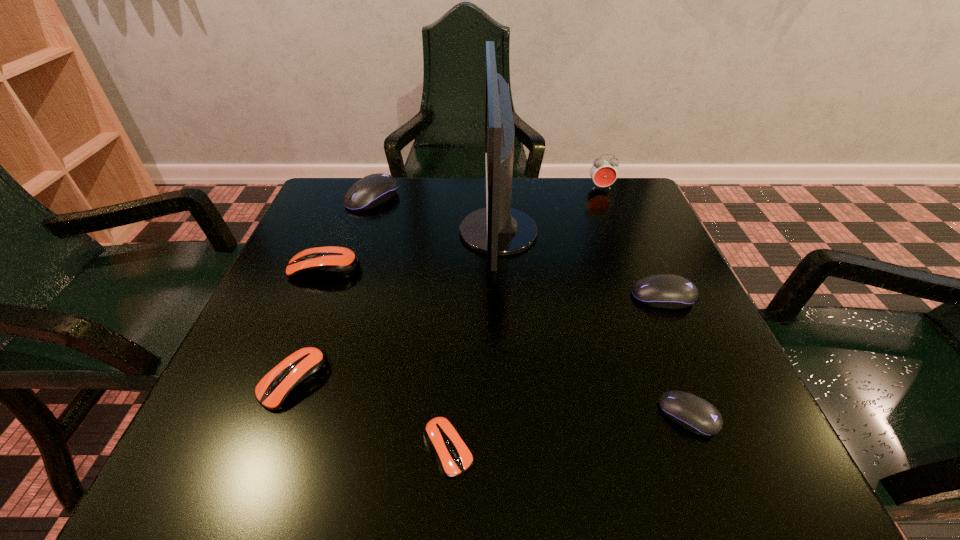
Select which object appears as the third closest to the nearest black computer mouse. Please provide its 2D coordinates. Your answer should be formatted as a tuple, i.e. [(x, y)], where the tuple contains the x and y coordinates of a point satisfying the conditions above.

[(441, 435)]

The width and height of the screenshot is (960, 540). I want to click on the second closest computer mouse relative to the tallest object, so click(668, 291).

This screenshot has width=960, height=540. In order to click on computer mouse that is the second closest one to the smallest black computer mouse in this screenshot , I will do `click(441, 435)`.

Identify which black computer mouse is the third nearest to the fourth computer mouse from left to right. Please provide its 2D coordinates. Your answer should be formatted as a tuple, i.e. [(x, y)], where the tuple contains the x and y coordinates of a point satisfying the conditions above.

[(372, 190)]

Identify which black computer mouse is the closest to the second nearest black computer mouse. Please provide its 2D coordinates. Your answer should be formatted as a tuple, i.e. [(x, y)], where the tuple contains the x and y coordinates of a point satisfying the conditions above.

[(696, 415)]

Identify the location of orange computer mouse that is the third closest one to the monitor. (441, 435).

What are the coordinates of `orange computer mouse identified as the third closest to the second biggest black computer mouse` in the screenshot? It's located at (302, 368).

You are a GUI agent. You are given a task and a screenshot of the screen. Output one action in this format:
    pyautogui.click(x=<x>, y=<y>)
    Task: Click on the free spot that satisfies the following two spatial constraints: 1. on the front side of the smallest black computer mouse; 2. on the left side of the tallest computer mouse
    
    Given the screenshot: What is the action you would take?
    pyautogui.click(x=299, y=415)

Where is `vacant space that satisfies the following two spatial constraints: 1. on the front side of the second biggest orange computer mouse; 2. on the right side of the nearest black computer mouse`? vacant space that satisfies the following two spatial constraints: 1. on the front side of the second biggest orange computer mouse; 2. on the right side of the nearest black computer mouse is located at coordinates (280, 415).

At what (x,y) coordinates should I click in order to perform the action: click on free space that satisfies the following two spatial constraints: 1. on the front side of the biggest orange computer mouse; 2. on the left side of the second biggest orange computer mouse. Please return your answer as a coordinate pair (x, y). The width and height of the screenshot is (960, 540). Looking at the image, I should click on (280, 381).